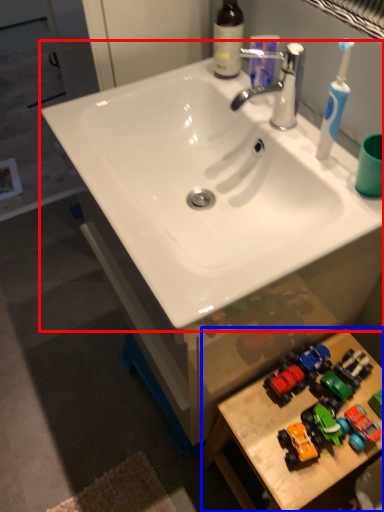
Question: Which of the following is the farthest to the observer, sink (highlighted by a red box) or table (highlighted by a blue box)?

Choices:
 (A) sink
 (B) table

Answer: (B)